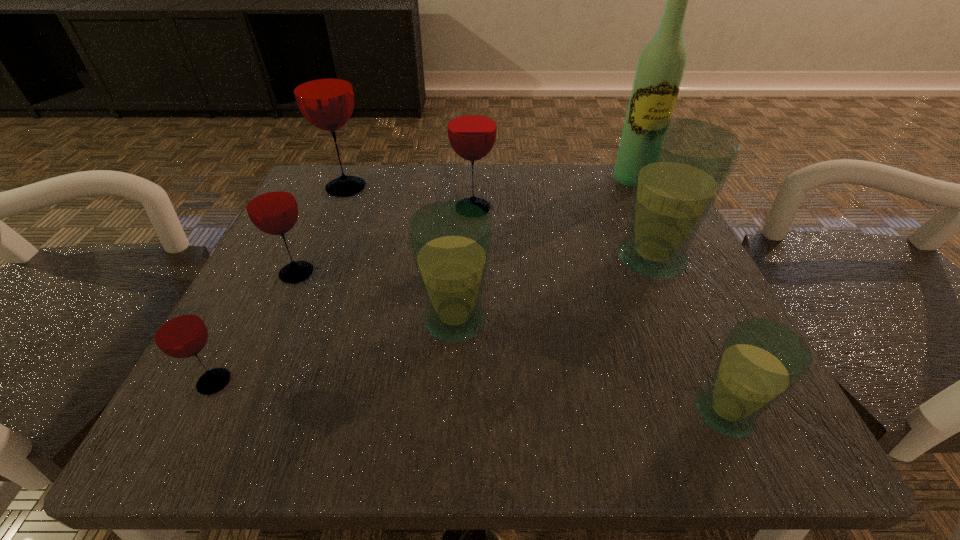
This screenshot has width=960, height=540. I want to click on free space that satisfies the following two spatial constraints: 1. on the front side of the third smallest red glass; 2. on the right side of the smallest blue glass, so click(469, 413).